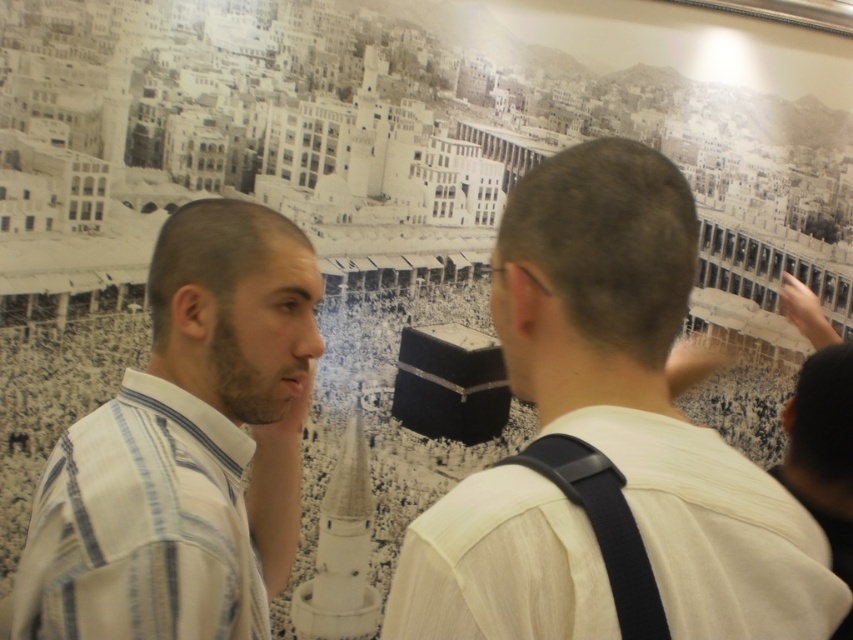
You are a photographer at the event and need to capture both the white shirt at center and the white striped shirt at center in a single frame. Which one should you focus on to ensure both are visible?

You should focus on the white shirt at center because it is bigger and will be more visible in the frame, allowing the smaller white striped shirt at center to also be captured clearly.

You are a photographer trying to capture a candid shot of the group. Since you can only focus on one person at a time, which person should you choose to ensure the white shirt at center and the white striped shirt at center are both visible in the frame?

You should focus on the white shirt at center because it is in front of the white striped shirt at center, making both visible in the frame.

You are a photographer trying to capture a group photo of the white shirt at center and the white striped shirt at center. Which of the two should you adjust the camera focus to first if you want to ensure both are in focus, considering their height difference?

The white shirt at center is not as tall as the white striped shirt at center, so you should focus on the taller white striped shirt at center first to ensure both are in focus.